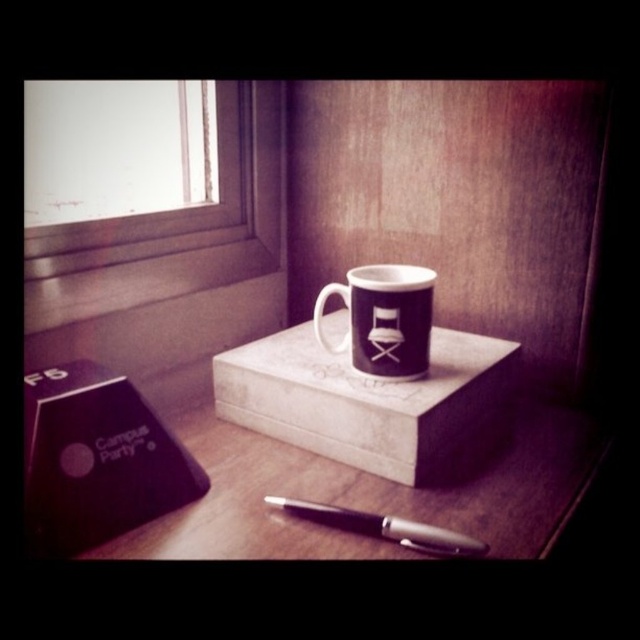
Question: Which point appears closest to the camera in this image?

Choices:
 (A) (193, 221)
 (B) (397, 355)
 (C) (352, 458)
 (D) (289, 508)

Answer: (D)

Question: Among these points, which one is nearest to the camera?

Choices:
 (A) (292, 376)
 (B) (252, 140)
 (C) (499, 468)

Answer: (C)

Question: Can you confirm if matte white box at center is positioned to the left of purple matte mug at upper center?

Choices:
 (A) yes
 (B) no

Answer: (A)

Question: Does matte white box at center appear on the left side of purple matte mug at upper center?

Choices:
 (A) no
 (B) yes

Answer: (B)

Question: Is matte wooden table at center positioned at the back of matte white box at center?

Choices:
 (A) no
 (B) yes

Answer: (A)

Question: Considering the real-world distances, which object is farthest from the transparent glass window at upper left?

Choices:
 (A) purple matte mug at upper center
 (B) black metallic pen at lower center
 (C) matte wooden table at center

Answer: (B)